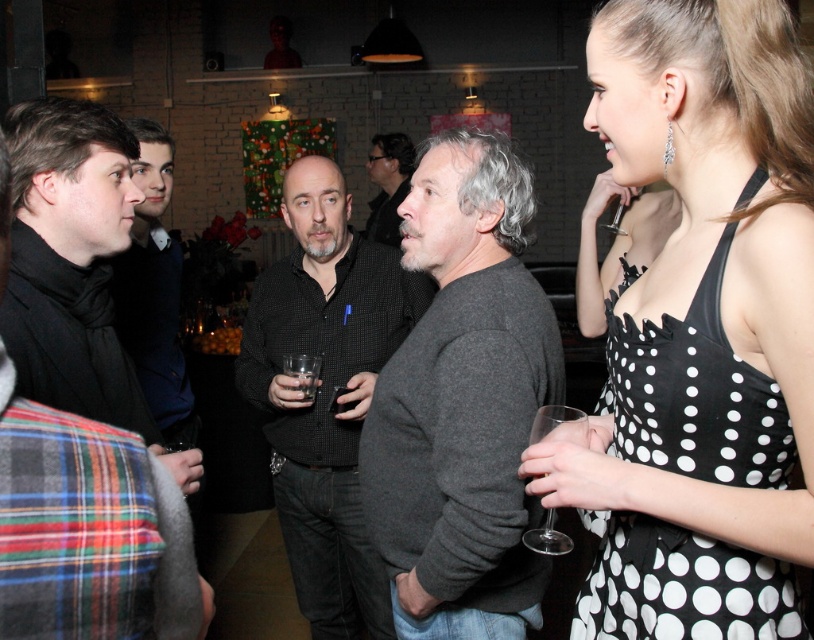
Which is more to the right, black textured shirt at center or black wool scarf at left?

From the viewer's perspective, black textured shirt at center appears more on the right side.

Who is more forward, [300,324] or [33,172]?

Point [33,172] is in front.

Which is in front, point (295, 218) or point (116, 172)?

Point (116, 172) is more forward.

The image size is (814, 640). Find the location of `black textured shirt at center`. black textured shirt at center is located at coordinates (326, 392).

Who is positioned more to the left, black polka dot dress at center or clear glass wine glass at lower right?

From the viewer's perspective, black polka dot dress at center appears more on the left side.

What do you see at coordinates (388, 184) in the screenshot?
I see `black polka dot dress at center` at bounding box center [388, 184].

This screenshot has width=814, height=640. Identify the location of black polka dot dress at center. (388, 184).

Does black polka dot dress at center have a smaller size compared to transparent glass at center?

Incorrect, black polka dot dress at center is not smaller in size than transparent glass at center.

Who is higher up, black polka dot dress at center or transparent glass at center?

black polka dot dress at center is higher up.

Is point (384, 225) less distant than point (305, 378)?

No, (384, 225) is further to viewer.

The height and width of the screenshot is (640, 814). I want to click on black polka dot dress at center, so click(x=388, y=184).